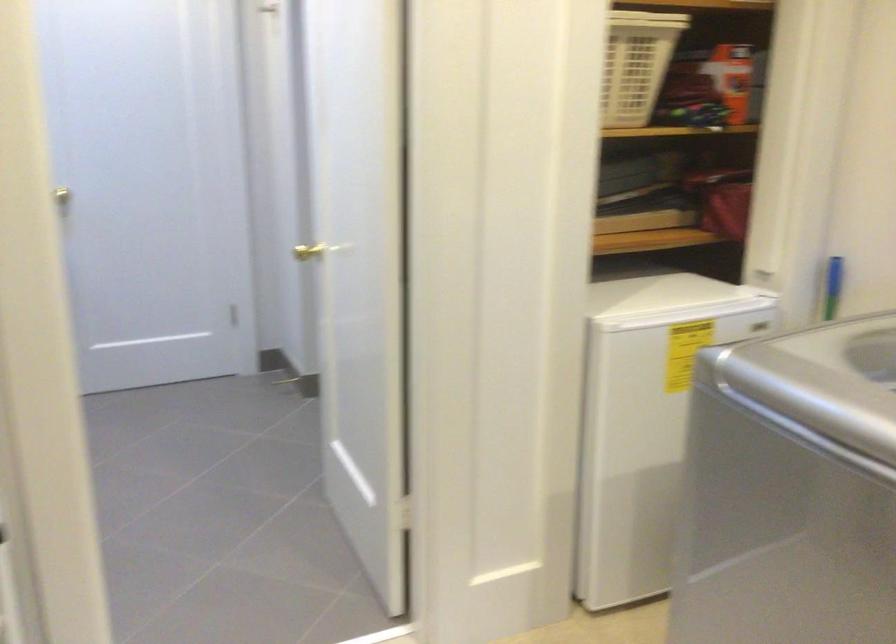
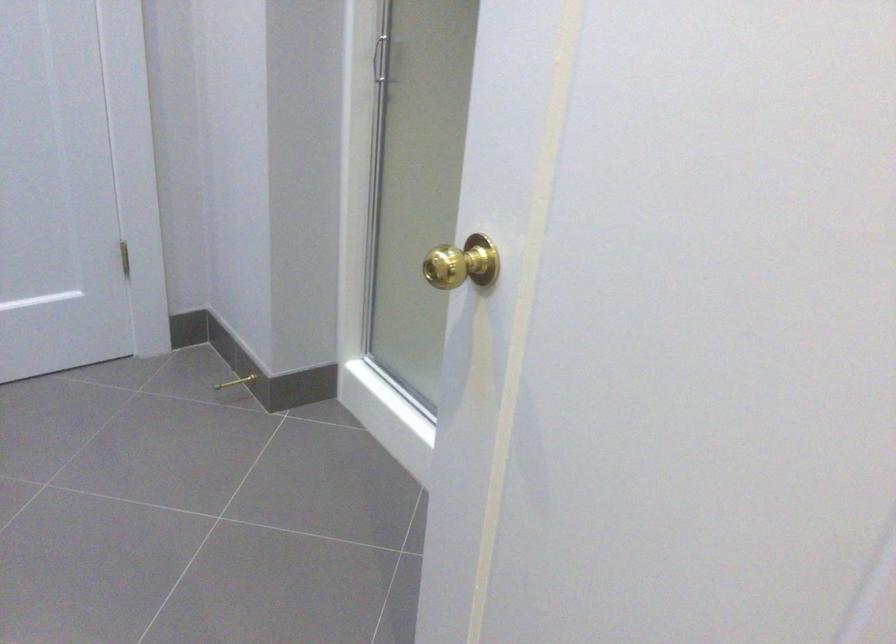
Find the pixel in the second image that matches point (303, 384) in the first image.

(235, 382)